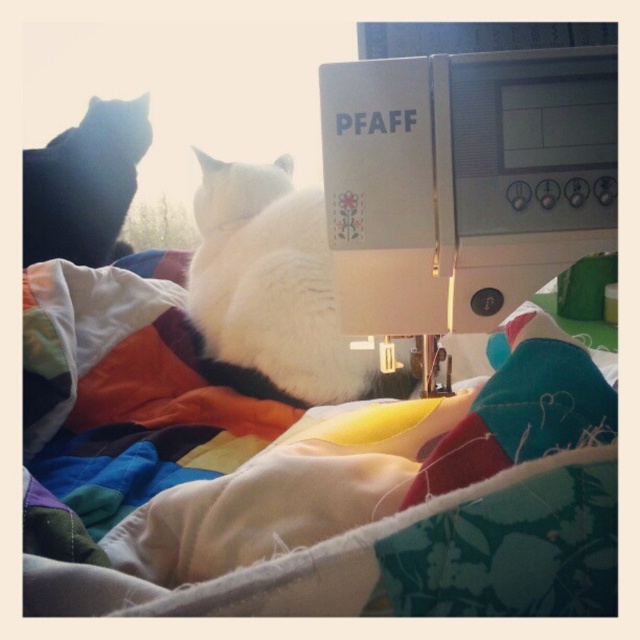
You are a tailor working on the PFAFF sewing machine on the right. You need to place a small button on the multicolored quilt at center so that it is visible from above the black fur cat at left. Is the quilt tall enough for this?

The multicolored quilt at center has a lesser height compared to black fur cat at left, so the quilt is not tall enough for the button to be visible from above the cat.

You are a cat owner who wants to place your cat on the multicolored quilt at center without it falling off. Considering the size of the black fur cat at left, can you fit it comfortably on the quilt?

The multicolored quilt at center has a larger size compared to the black fur cat at left, so the cat can fit comfortably on the quilt without falling off.

You are organizing a small craft fair and need to display both the multicolored quilt at center and the white plastic sewing machine at upper right. If you want to place them side by side on a table, which item should you position first to ensure they both fit?

The multicolored quilt at center has a larger width than the white plastic sewing machine at upper right, so you should position the multicolored quilt at center first to ensure there is enough space for both items on the table.